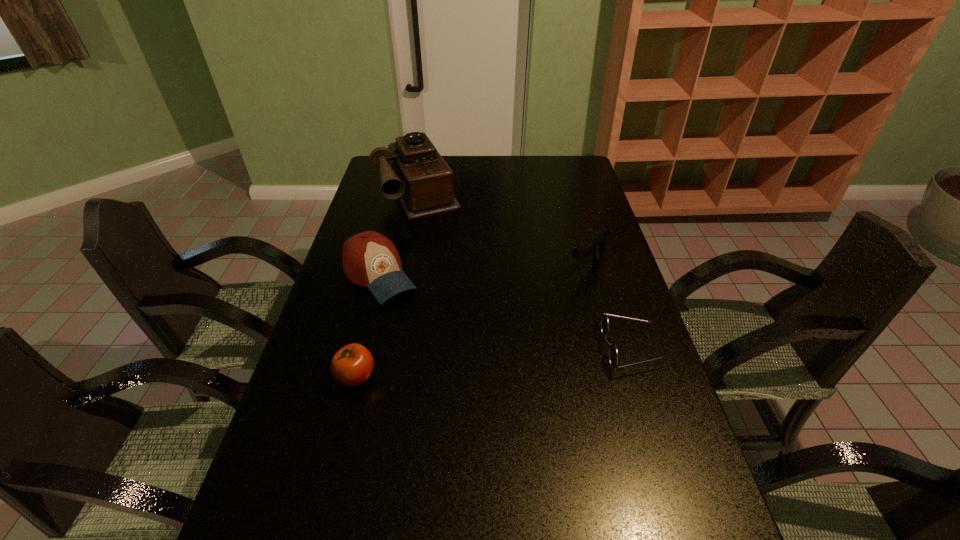
Locate an element on the screen. free point located on the horn of the tallest object is located at coordinates (468, 287).

This screenshot has width=960, height=540. What are the coordinates of `free space located 0.390m on the horn of the tallest object` in the screenshot? It's located at (468, 287).

The width and height of the screenshot is (960, 540). In order to click on vacant space positioned 0.050m on the horn of the tallest object in this screenshot , I will do `click(435, 226)`.

Find the location of `vacant area situated 0.240m on the front-facing side of the baseball cap`. vacant area situated 0.240m on the front-facing side of the baseball cap is located at coordinates (443, 353).

The height and width of the screenshot is (540, 960). What are the coordinates of `vacant space located on the front-facing side of the baseball cap` in the screenshot? It's located at (460, 374).

Where is `vacant area located 0.270m on the front-facing side of the baseball cap`? The height and width of the screenshot is (540, 960). vacant area located 0.270m on the front-facing side of the baseball cap is located at coordinates 449,361.

Where is `object located at the far edge`? The width and height of the screenshot is (960, 540). object located at the far edge is located at coordinates (421, 179).

What are the coordinates of `apple that is at the left edge` in the screenshot? It's located at (352, 365).

Identify the location of phonograph_record that is at the left edge. The height and width of the screenshot is (540, 960). (421, 179).

Where is `baseball cap present at the left edge`? Image resolution: width=960 pixels, height=540 pixels. baseball cap present at the left edge is located at coordinates (370, 259).